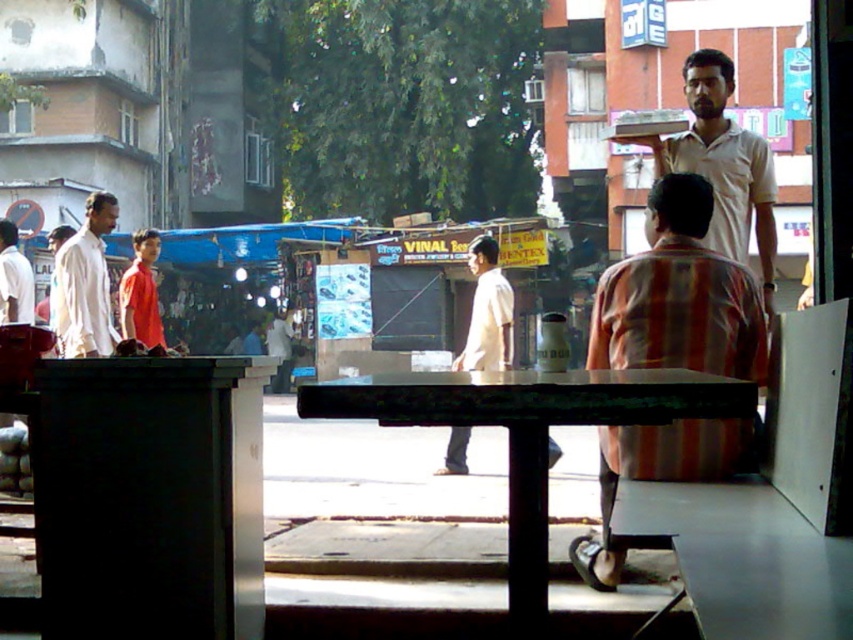
Which of these two, striped cotton shirt at center or light beige shirt at upper right, stands taller?

Standing taller between the two is striped cotton shirt at center.

Which is behind, point (631, 461) or point (769, 202)?

The point (769, 202) is more distant.

Image resolution: width=853 pixels, height=640 pixels. I want to click on striped cotton shirt at center, so click(679, 296).

Can you confirm if striped cotton shirt at center is wider than white cotton shirt at left?

Correct, the width of striped cotton shirt at center exceeds that of white cotton shirt at left.

Between striped cotton shirt at center and white cotton shirt at left, which one has less height?

white cotton shirt at left

Image resolution: width=853 pixels, height=640 pixels. I want to click on striped cotton shirt at center, so click(x=679, y=296).

Which of these two, green painted wood table at center or white cotton shirt at left, stands shorter?

With less height is green painted wood table at center.

Does green painted wood table at center appear under white cotton shirt at left?

Yes, green painted wood table at center is below white cotton shirt at left.

Where is `green painted wood table at center`? This screenshot has width=853, height=640. green painted wood table at center is located at coordinates (529, 429).